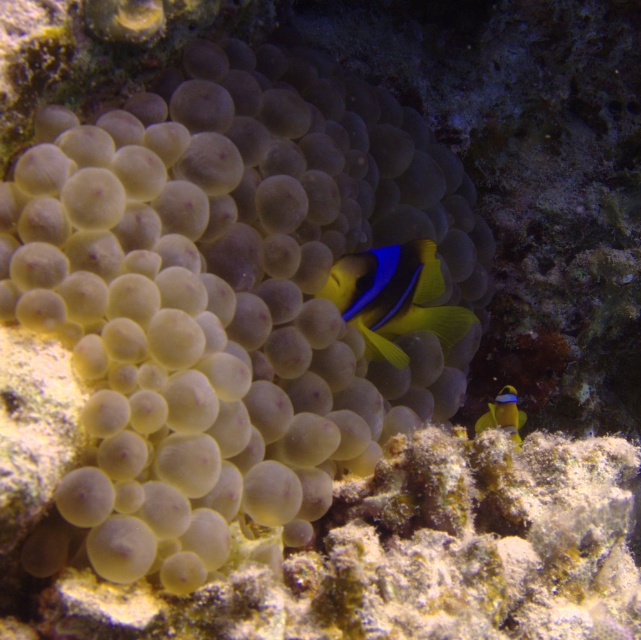
Question: Which point is farther to the camera?

Choices:
 (A) (372, 285)
 (B) (487, 417)

Answer: (B)

Question: Is yellow matte clownfish at center wider than yellow matte clownfish at lower right?

Choices:
 (A) no
 (B) yes

Answer: (B)

Question: Which point is farther to the camera?

Choices:
 (A) yellow matte clownfish at lower right
 (B) yellow matte clownfish at center

Answer: (B)

Question: Can you confirm if yellow matte clownfish at center is positioned below yellow matte clownfish at lower right?

Choices:
 (A) no
 (B) yes

Answer: (A)

Question: From the image, what is the correct spatial relationship of yellow matte clownfish at center in relation to yellow matte clownfish at lower right?

Choices:
 (A) left
 (B) right

Answer: (A)